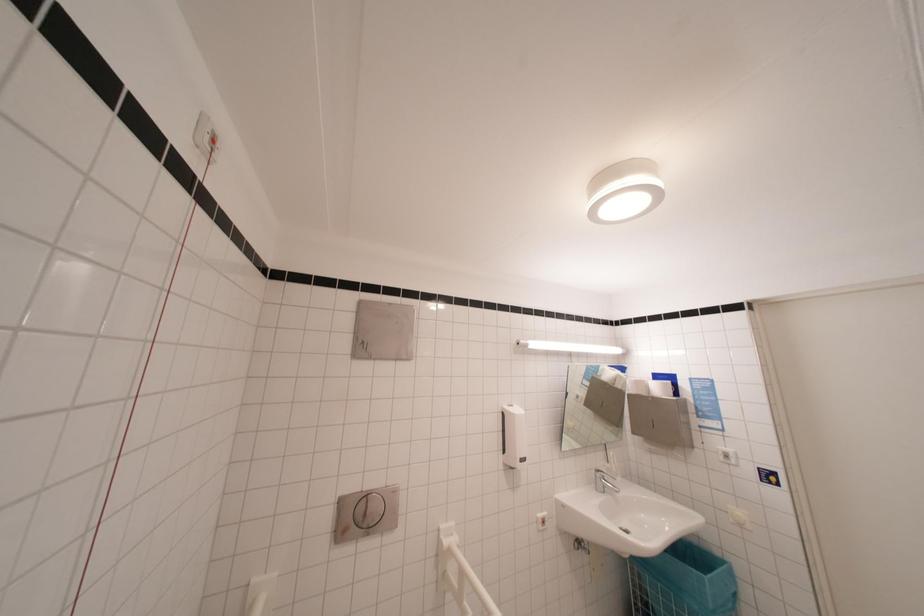
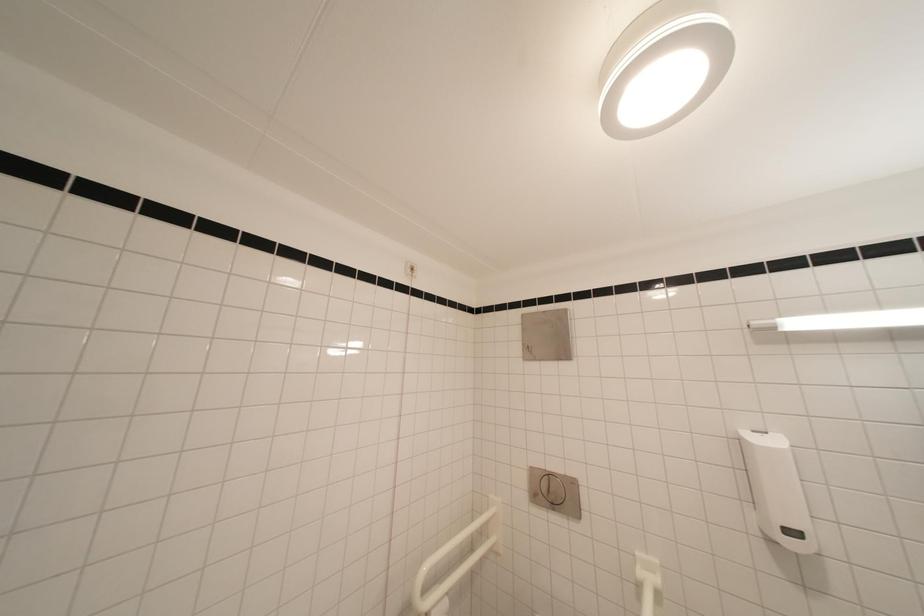
Question: The images are taken continuously from a first-person perspective. In which direction is your viewpoint rotating?

Choices:
 (A) Left
 (B) Right
 (C) Up
 (D) Down

Answer: (A)